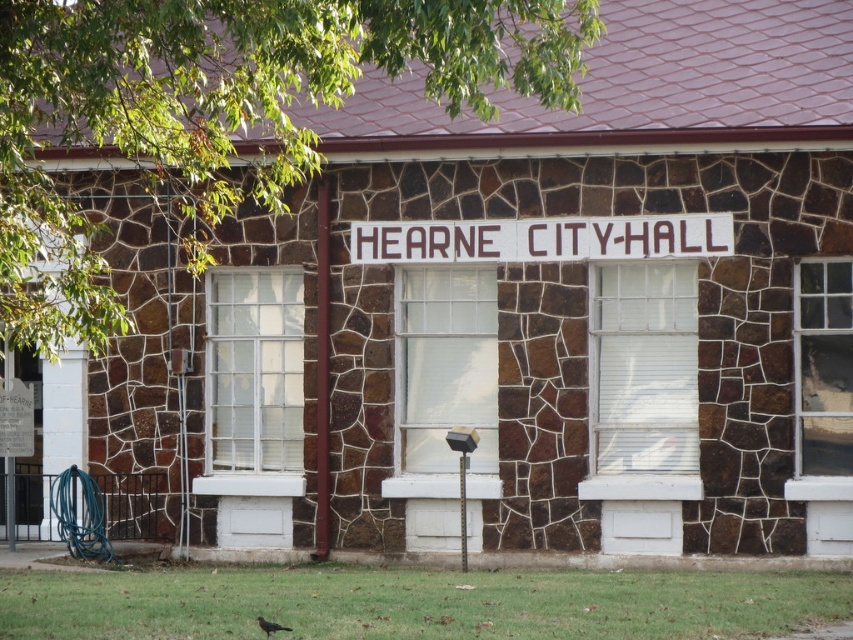
Does clear glass window at center appear over clear glass window at right?

Incorrect, clear glass window at center is not positioned above clear glass window at right.

Between clear glass window at center and clear glass window at right, which one appears on the left side from the viewer's perspective?

clear glass window at center is more to the left.

You are a GUI agent. You are given a task and a screenshot of the screen. Output one action in this format:
    pyautogui.click(x=<x>, y=<y>)
    Task: Click on the clear glass window at center
    The image size is (853, 640).
    Given the screenshot: What is the action you would take?
    pyautogui.click(x=445, y=365)

At what (x,y) coordinates should I click in order to perform the action: click on clear glass window at center. Please return your answer as a coordinate pair (x, y). This screenshot has height=640, width=853. Looking at the image, I should click on (445, 365).

Can you confirm if white glass window at center is positioned to the right of clear glass window at center?

Incorrect, white glass window at center is not on the right side of clear glass window at center.

Who is more forward, (236, 296) or (469, 316)?

Positioned in front is point (469, 316).

The image size is (853, 640). I want to click on white glass window at center, so click(254, 381).

Can you confirm if white glass window at center is positioned to the left of clear glass window at right?

Yes, white glass window at center is to the left of clear glass window at right.

Who is lower down, white glass window at center or clear glass window at right?

white glass window at center

Who is more distant from viewer, (x=260, y=438) or (x=851, y=372)?

The point (x=260, y=438) is more distant.

At what (x,y) coordinates should I click in order to perform the action: click on white glass window at center. Please return your answer as a coordinate pair (x, y). The image size is (853, 640). Looking at the image, I should click on (254, 381).